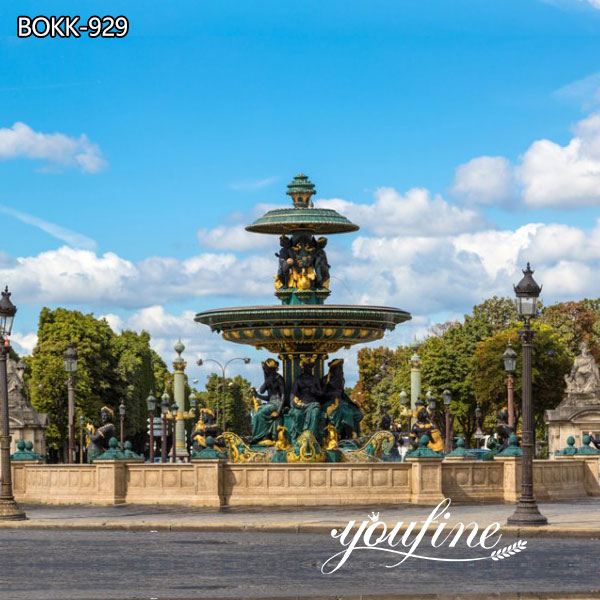
Where is `lamp`? lamp is located at coordinates (526, 429), (1, 409), (68, 409).